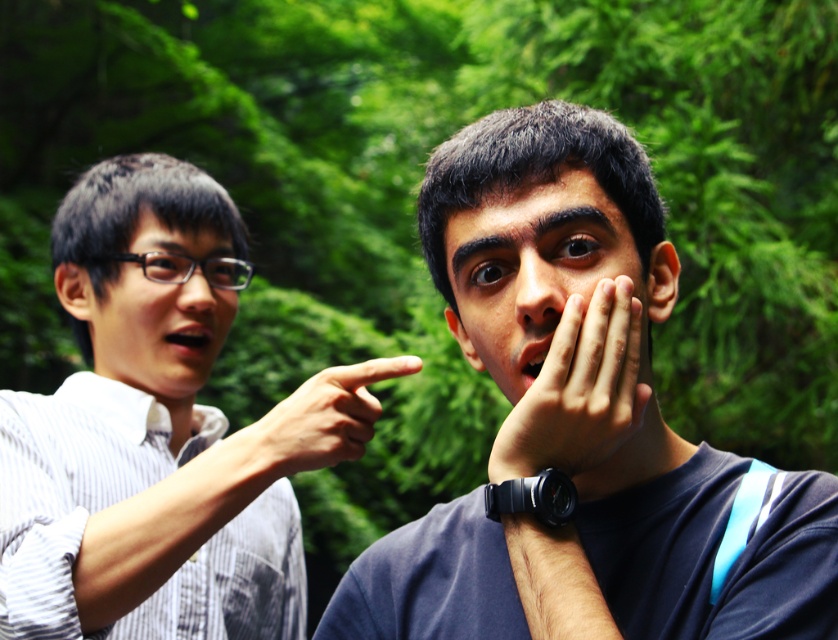
Question: Can you confirm if matte skin finger at center is smaller than matte skin mouth at left?

Choices:
 (A) no
 (B) yes

Answer: (A)

Question: Can you confirm if dark blue t-shirt at center is smaller than matte black nose at left?

Choices:
 (A) no
 (B) yes

Answer: (A)

Question: Which point is closer to the camera taking this photo?

Choices:
 (A) (361, 381)
 (B) (618, 406)

Answer: (B)

Question: Which point is farther to the camera?

Choices:
 (A) (542, 355)
 (B) (205, 340)

Answer: (B)

Question: Does dark blue t-shirt at center have a greater width compared to matte black nose at left?

Choices:
 (A) yes
 (B) no

Answer: (A)

Question: Which point is farther to the camera?

Choices:
 (A) dark blue t-shirt at center
 (B) white striped shirt at left
 (C) matte skin face at center

Answer: (B)